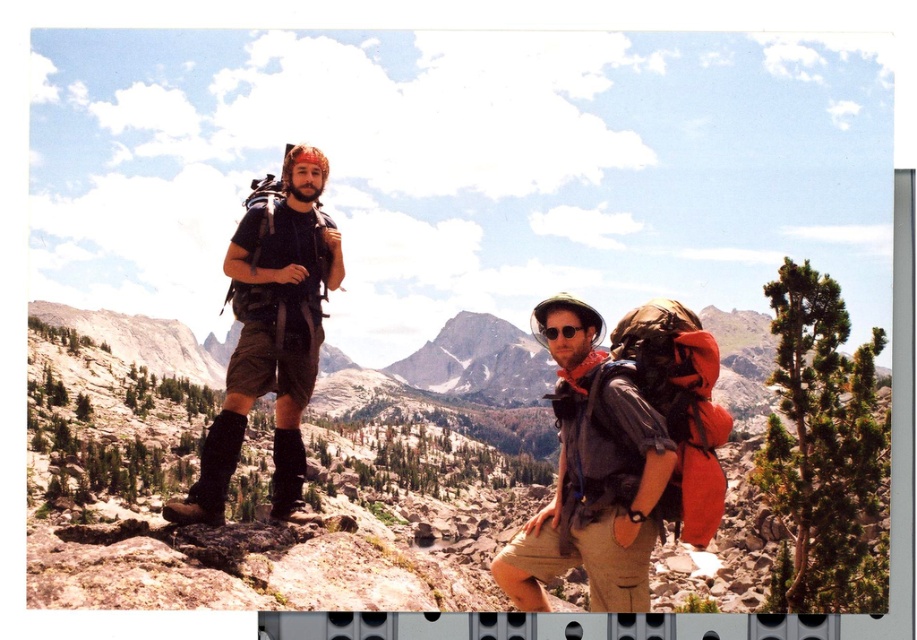
Who is taller, matte black backpack at center or black suede boot at center?

Standing taller between the two is matte black backpack at center.

Does point (660, 429) come in front of point (301, 497)?

Yes, it is in front of point (301, 497).

The image size is (917, 640). Identify the location of matte black backpack at center. (592, 477).

Who is positioned more to the right, matte black backpack at center or leather boot at left?

matte black backpack at center

Between point (561, 529) and point (170, 508), which one is positioned in front?

Point (170, 508)

Is point (589, 547) more distant than point (205, 454)?

That is True.

Image resolution: width=917 pixels, height=640 pixels. What are the coordinates of `matte black backpack at center` in the screenshot? It's located at (592, 477).

Is matte black backpack at left bigger than black suede boot at center?

Indeed, matte black backpack at left has a larger size compared to black suede boot at center.

Is matte black backpack at left taller than black suede boot at center?

Yes.

Who is more distant from viewer, [217,456] or [280,506]?

The point [280,506] is behind.

Find the location of a particular element. This screenshot has width=917, height=640. matte black backpack at left is located at coordinates (271, 332).